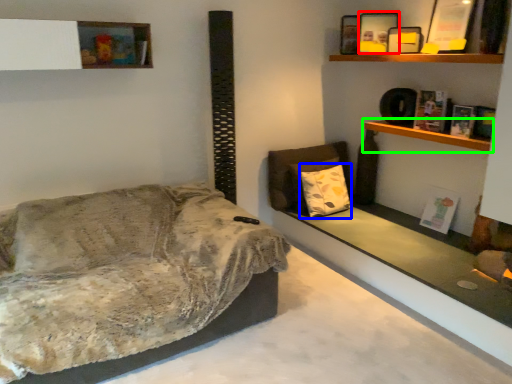
Question: Which object is the farthest from picture frame (highlighted by a red box)? Choose among these: pillow (highlighted by a blue box) or shelf (highlighted by a green box).

Choices:
 (A) pillow
 (B) shelf

Answer: (A)